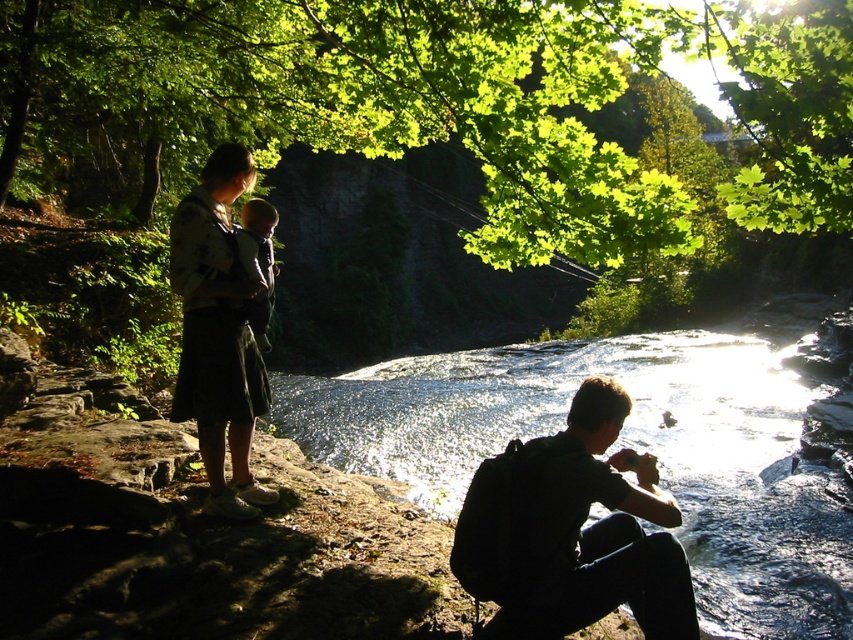
From the picture: You are standing at point (260, 397) and want to move to point (816, 476). Are you facing the same direction as the woman holding the baby?

The point (816, 476) is behind point (260, 397), so if you are moving from point (260, 397) to point (816, 476), you would be facing away from the woman holding the baby, who is on the left side of the image observing the surroundings.

You are a parent trying to keep your baby safe near the river. You see the translucent water at center and the soft gray fabric baby at center. How far apart are they?

The distance between the translucent water at center and the soft gray fabric baby at center is 15.48 meters, so they are quite far apart.